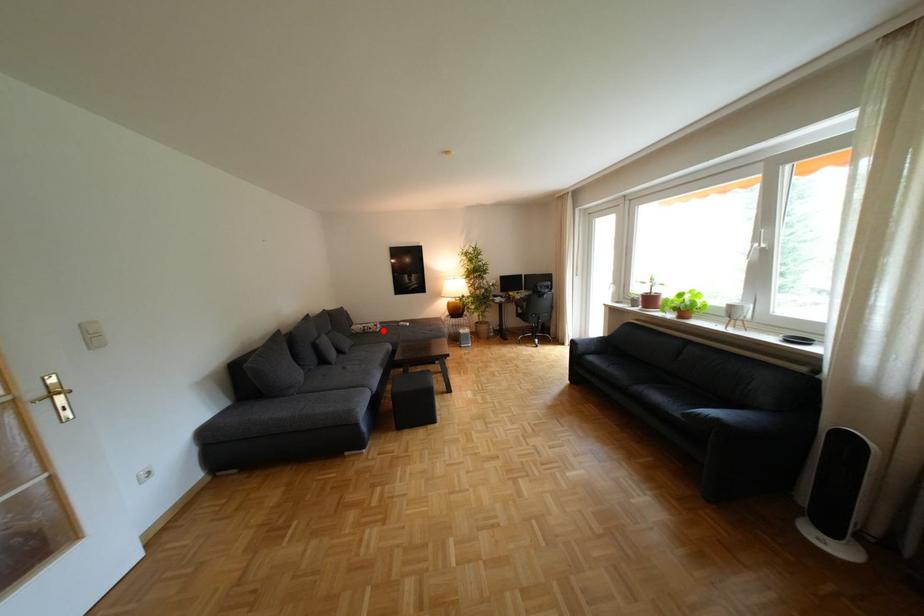
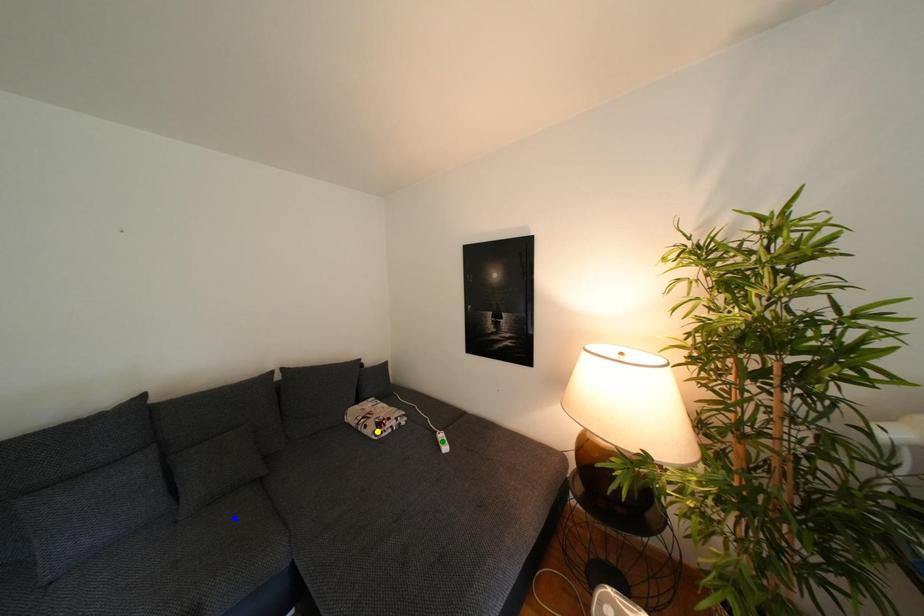
Question: I am providing you with two images of the same scene from different viewpoints. A red point is marked on the first image. You are given multiple points on the second image. Can you choose the point in image 2 that corresponds to the point in image 1?

Choices:
 (A) blue point
 (B) yellow point
 (C) green point

Answer: (B)